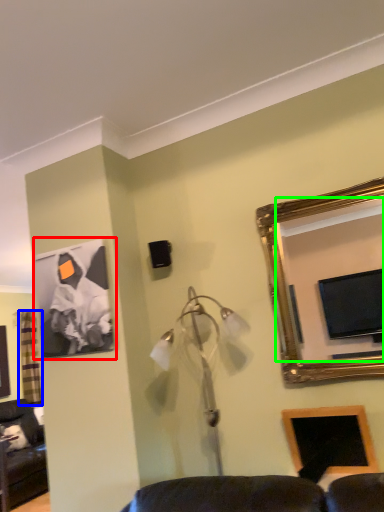
Question: Estimate the real-world distances between objects in this image. Which object is closer to picture frame (highlighted by a red box), curtain (highlighted by a blue box) or mirror (highlighted by a green box)?

Choices:
 (A) curtain
 (B) mirror

Answer: (B)